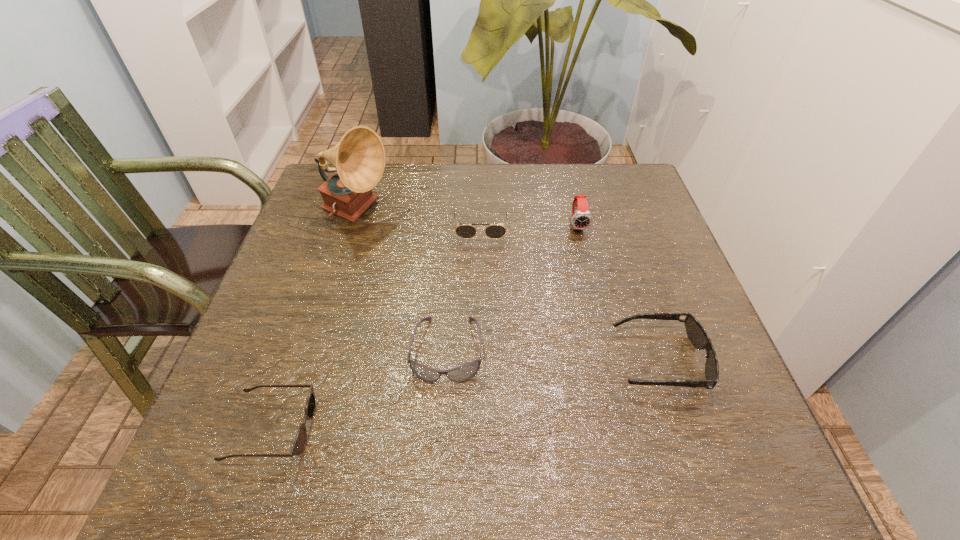
This screenshot has height=540, width=960. I want to click on phonograph record, so click(359, 158).

Identify the location of watch. (581, 219).

Find the location of a particular element. the tallest sunglasses is located at coordinates (493, 231).

Where is `the fourth shortest object`? the fourth shortest object is located at coordinates (493, 231).

At what (x,y) coordinates should I click in order to perform the action: click on the rightmost sunglasses. Please return your answer as a coordinate pair (x, y). The height and width of the screenshot is (540, 960). Looking at the image, I should click on (696, 333).

Identify the location of the shortest sunglasses. The image size is (960, 540). (299, 444).

At what (x,y) coordinates should I click in order to perform the action: click on the shortest object. Please return your answer as a coordinate pair (x, y). Looking at the image, I should click on (299, 444).

The height and width of the screenshot is (540, 960). Identify the location of free space located 0.380m on the horn of the phonograph record. tap(540, 214).

The image size is (960, 540). I want to click on vacant space located 0.200m on the face of the fifth shortest object, so click(x=595, y=296).

At what (x,y) coordinates should I click in order to perform the action: click on vacant space located 0.250m on the front lenses of the third tallest object. Please return your answer as a coordinate pair (x, y). Image resolution: width=960 pixels, height=540 pixels. Looking at the image, I should click on (481, 328).